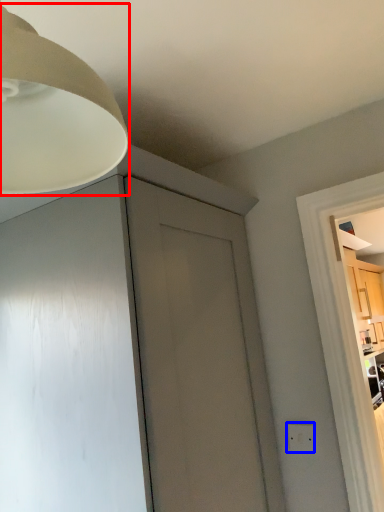
Question: Which object is closer to the camera taking this photo, lamp (highlighted by a red box) or electric outlet (highlighted by a blue box)?

Choices:
 (A) lamp
 (B) electric outlet

Answer: (A)